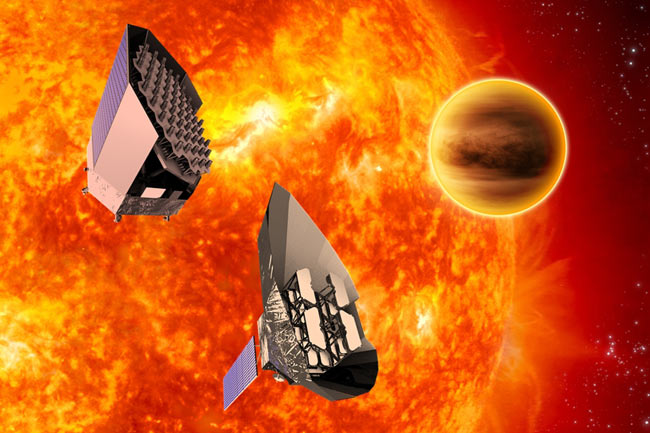
Identify the location of dark corner. The image size is (650, 433). (634, 18).